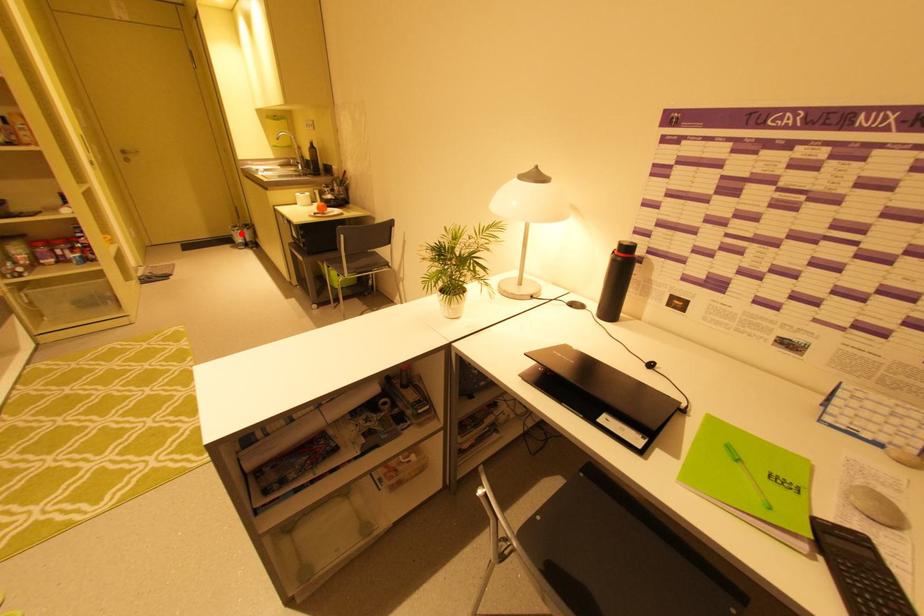
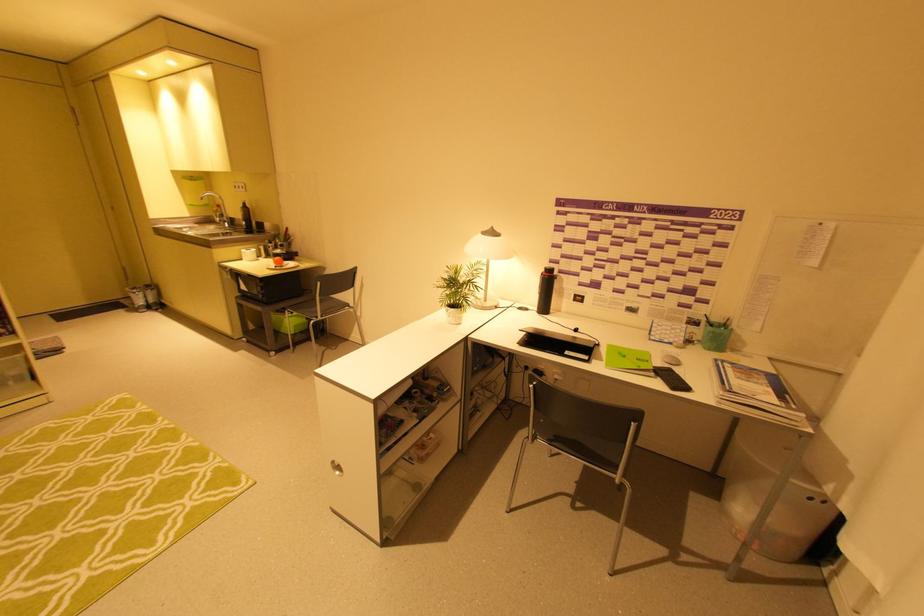
The point at the highlighted location is marked in the first image. Where is the corresponding point in the second image?

(142, 296)